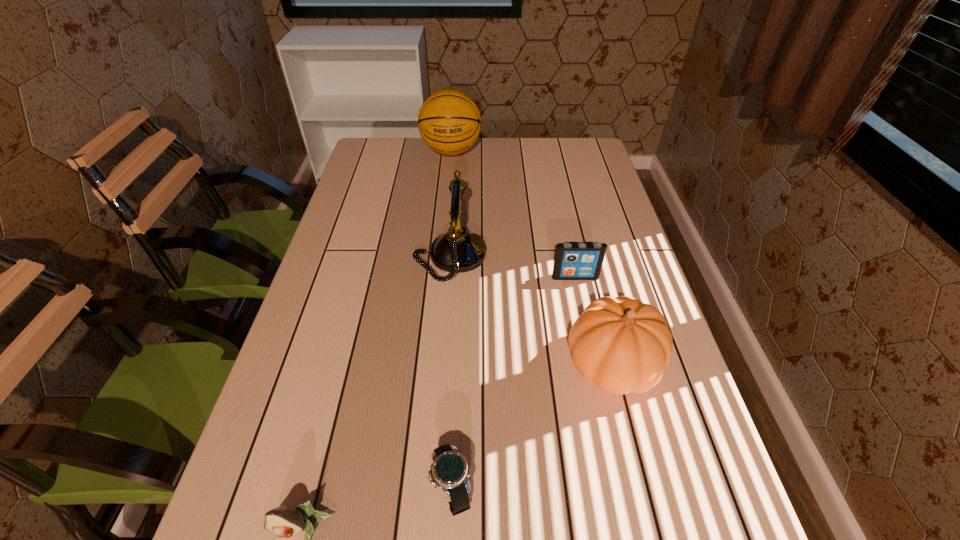
Identify the location of basketball. (449, 121).

In order to click on telephone in this screenshot , I will do `click(456, 251)`.

The image size is (960, 540). I want to click on the fourth farthest object, so click(x=623, y=345).

Where is `iPod`? The width and height of the screenshot is (960, 540). iPod is located at coordinates (573, 260).

Identify the location of watch. (450, 470).

At what (x,y) coordinates should I click in order to perform the action: click on free location located 0.270m on the surface of the farthest object near the brand logo. Please return your answer as a coordinate pair (x, y). Looking at the image, I should click on (445, 217).

At what (x,y) coordinates should I click in order to perform the action: click on free region located 0.060m on the dial of the telephone. Please return your answer as a coordinate pair (x, y). The image size is (960, 540). Looking at the image, I should click on point(509,257).

Locate an element on the screen. vacant space located 0.130m on the left of the pumpkin is located at coordinates (504, 364).

Find the location of a particular element. vacant space situated 0.320m on the front screen of the iPod is located at coordinates (600, 394).

At what (x,y) coordinates should I click in order to perform the action: click on vacant region located 0.260m on the left of the watch. Please return your answer as a coordinate pair (x, y). Looking at the image, I should click on (279, 489).